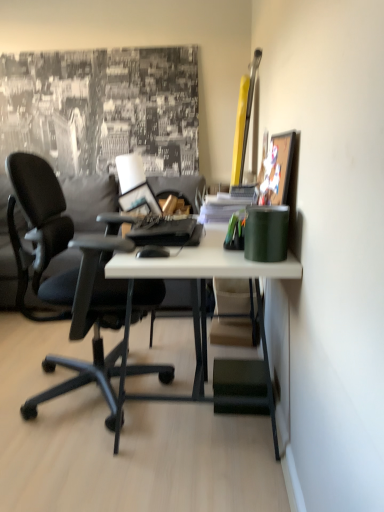
Question: Choose the correct answer: Is wooden picture frame at upper right inside satin black laptop at center or outside it?

Choices:
 (A) inside
 (B) outside

Answer: (B)

Question: From the image's perspective, is wooden picture frame at upper right above or below satin black laptop at center?

Choices:
 (A) below
 (B) above

Answer: (B)

Question: Which object is the closest to the white matte desk at center?

Choices:
 (A) satin black laptop at center
 (B) black matte mouse at center
 (C) gray fabric pillow at left
 (D) green matte cup at right, placed as the first stationery when sorted from front to back
 (E) green plastic pen holder at center, the first stationery when ordered from back to front

Answer: (B)

Question: Considering the real-world distances, which object is closest to the gray fabric pillow at left?

Choices:
 (A) black matte mouse at center
 (B) green matte cup at right, which is the 2th stationery in back-to-front order
 (C) wooden picture frame at upper right
 (D) green plastic pen holder at center, the first stationery when ordered from back to front
 (E) satin black laptop at center

Answer: (E)